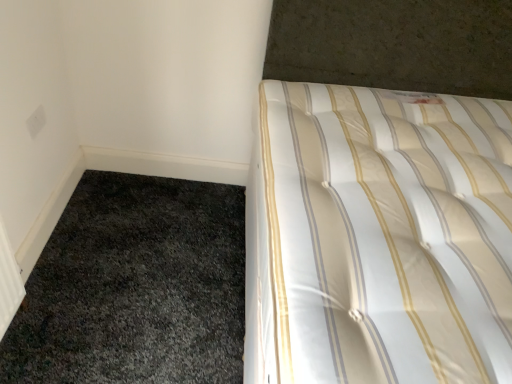
Describe the element at coordinates (36, 121) in the screenshot. The height and width of the screenshot is (384, 512). I see `white plastic electric outlet at upper left` at that location.

Identify the location of white plastic electric outlet at upper left. Image resolution: width=512 pixels, height=384 pixels. (36, 121).

Locate an element on the screen. Image resolution: width=512 pixels, height=384 pixels. white plastic electric outlet at upper left is located at coordinates (36, 121).